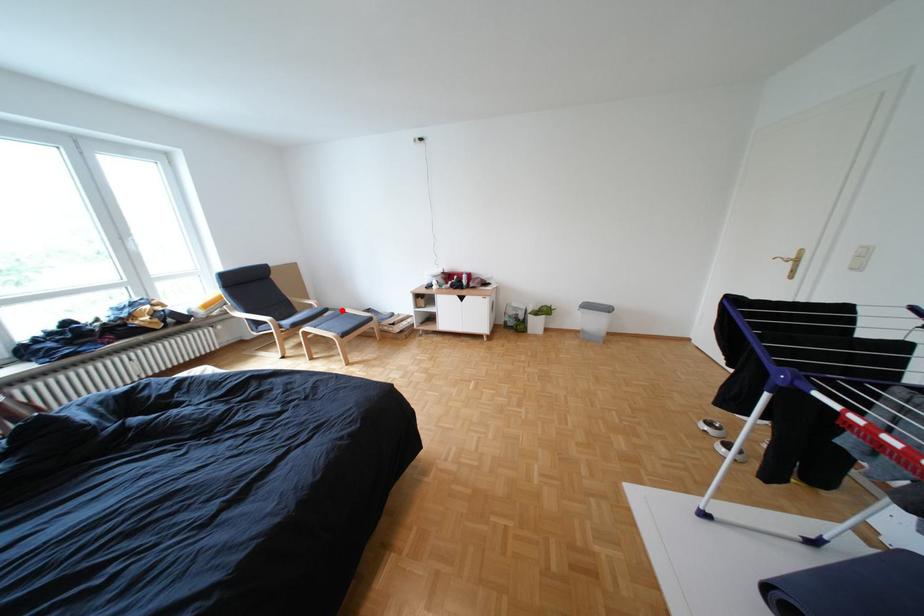
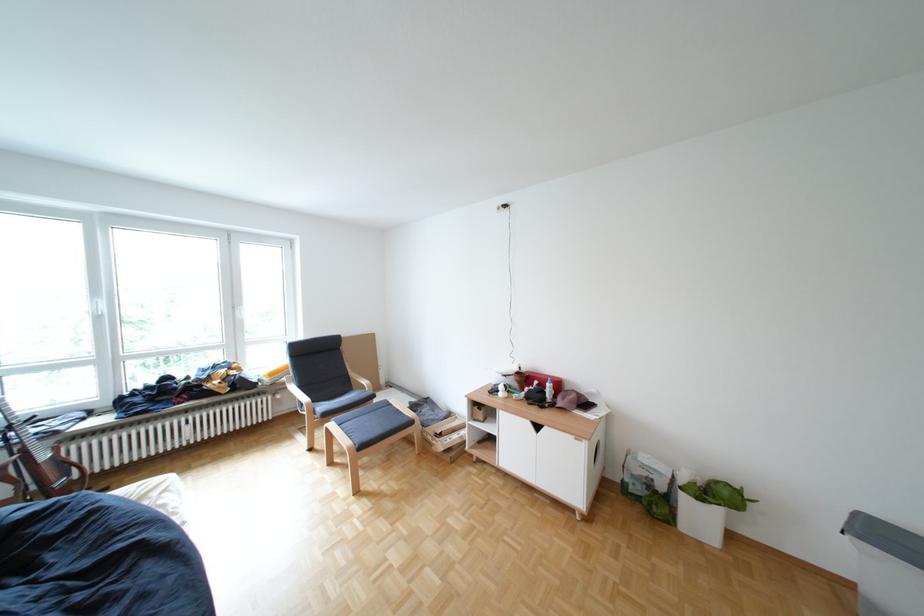
Question: A red point is marked in image1. In image2, is the corresponding 3D point closer to the camera or farther? Reply with the corresponding letter.

Choices:
 (A) The corresponding 3D point is closer.
 (B) The corresponding 3D point is farther.

Answer: (A)